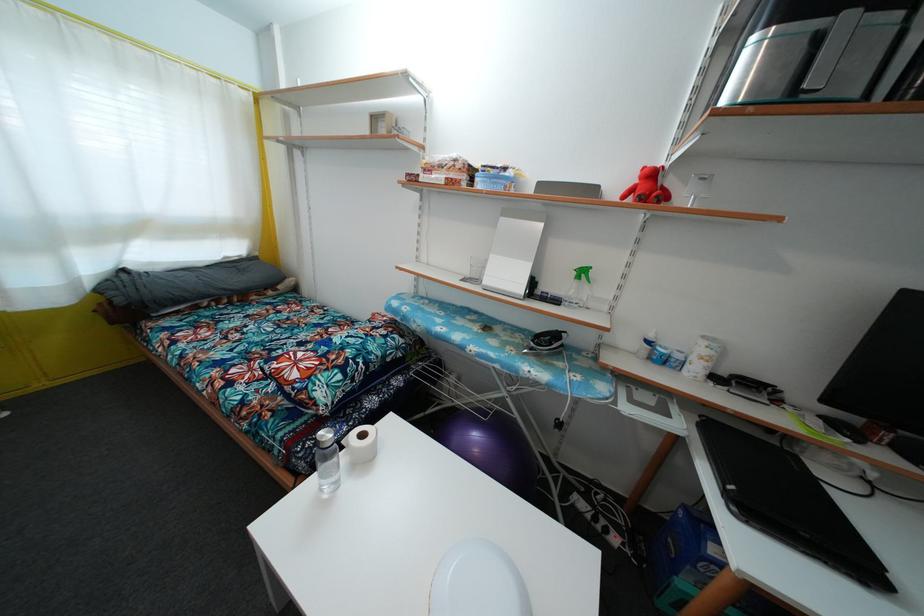
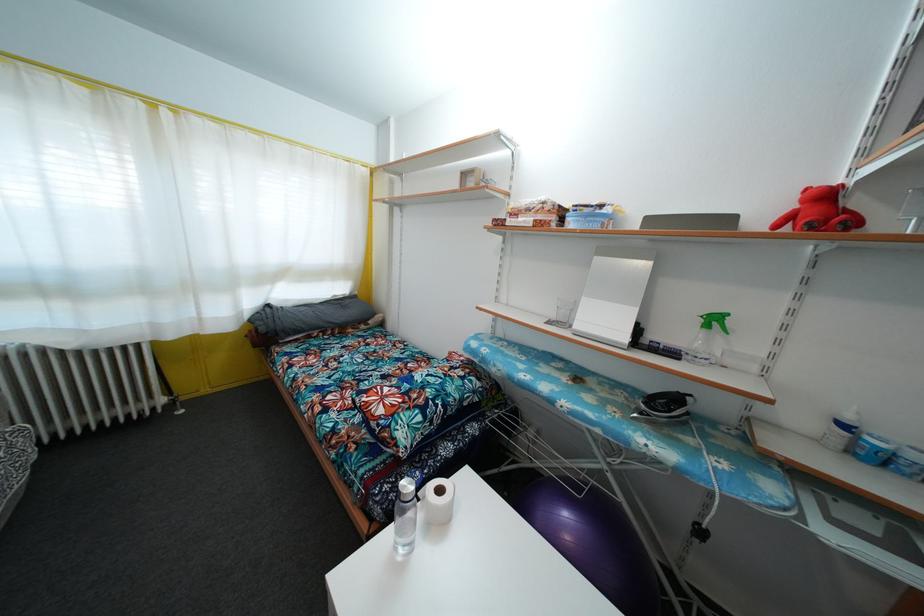
Question: How did the camera likely rotate?

Choices:
 (A) Left
 (B) Right
 (C) Up
 (D) Down

Answer: (A)